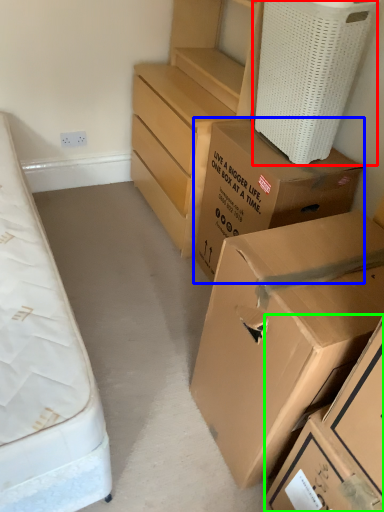
Question: Considering the real-world distances, which object is farthest from laundry basket (highlighted by a red box)? box (highlighted by a blue box) or box (highlighted by a green box)?

Choices:
 (A) box
 (B) box

Answer: (B)